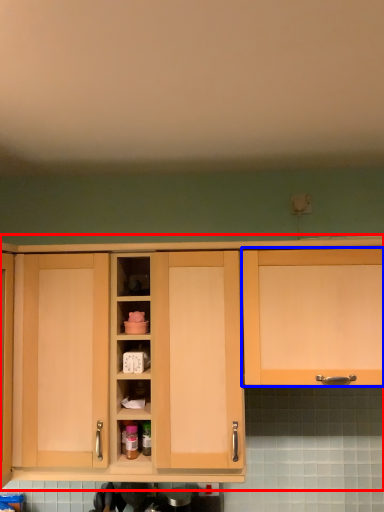
Question: Which object is closer to the camera taking this photo, cabinetry (highlighted by a red box) or cabinetry (highlighted by a blue box)?

Choices:
 (A) cabinetry
 (B) cabinetry

Answer: (B)